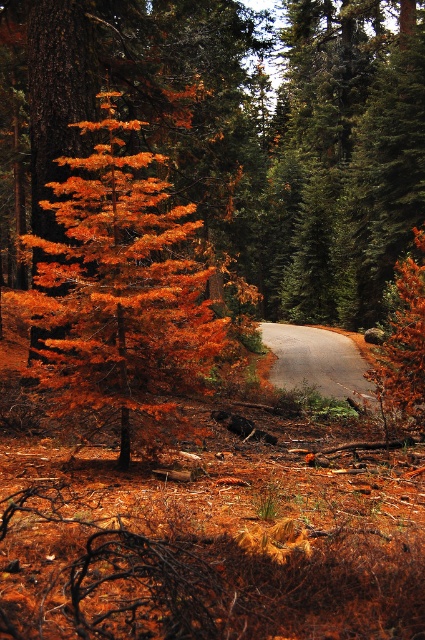
You are a hiker walking along the gray asphalt road at center in the forest. You want to take a photo of the orange matte tree at center. Which side of the road should you stand on to get the best view of the tree?

You should stand on the left side of the gray asphalt road at center because the orange matte tree at center is positioned to the left of the road, making it more visible from that side.

You are standing at the entrance of the forest and want to reach the orange matte tree at center. Given that the paved road curves through the forest, can you walk directly to the tree without following the road?

The orange matte tree at center is located at point coordinates, but without specific information about the terrain or obstacles between your current position and the tree, it is not possible to determine if you can walk directly to it without following the road. The scene description mentions a paved road curving through the forest, but does not provide details about the accessibility of the area around the tree.